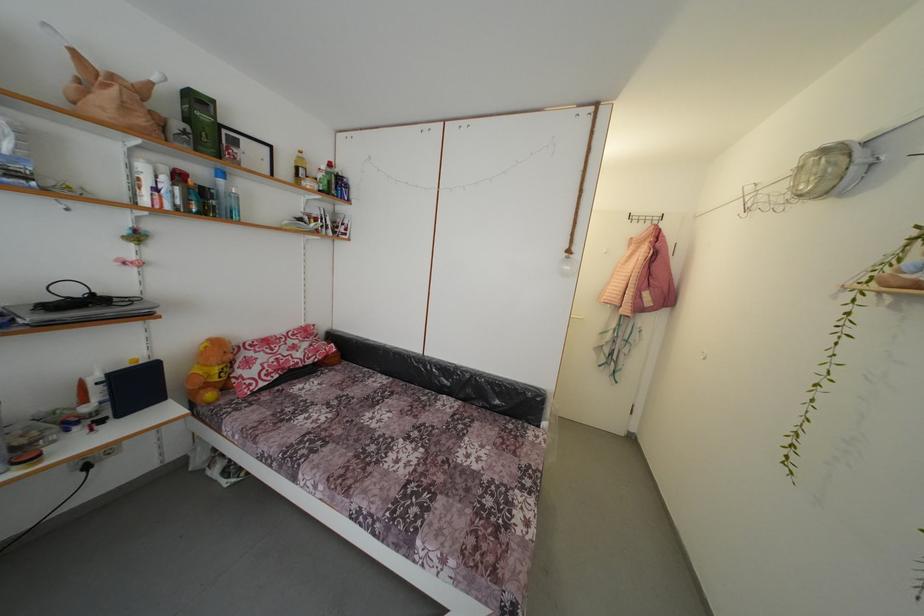
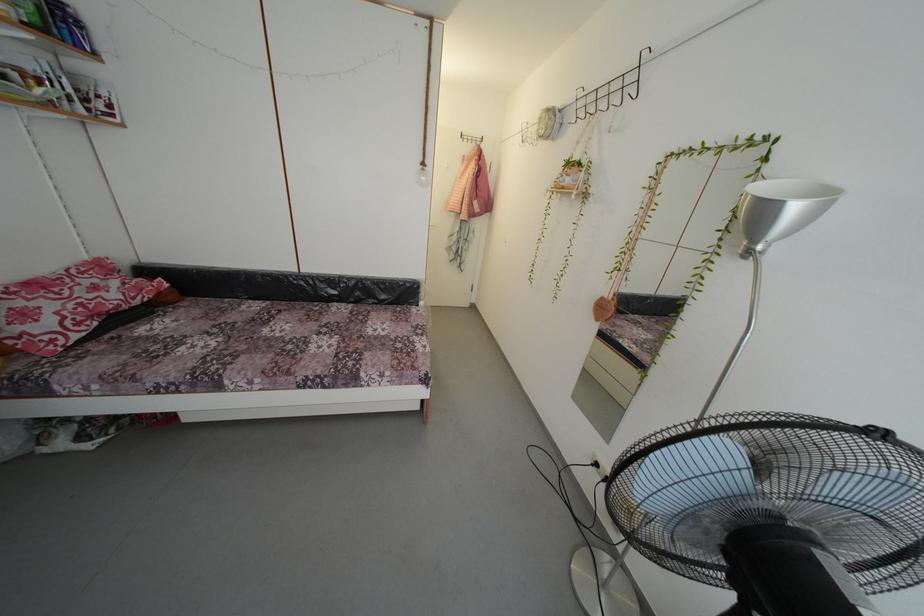
Find the pixel in the second image that matches (x=334, y=421) in the first image.

(225, 345)